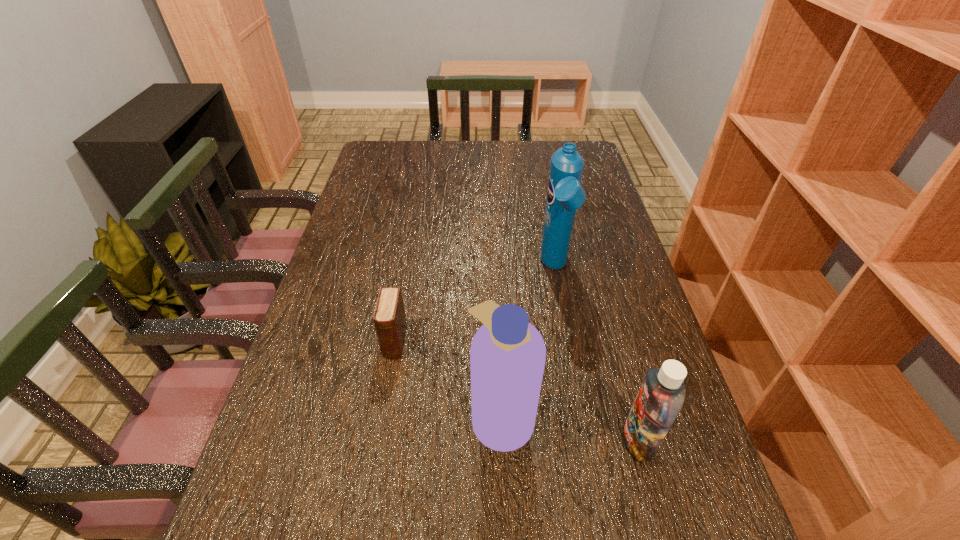
Locate an element on the screen. Image resolution: width=960 pixels, height=540 pixels. the third object from left to right is located at coordinates (565, 195).

Where is `the second shampoo from right to left`? The image size is (960, 540). the second shampoo from right to left is located at coordinates (565, 195).

Image resolution: width=960 pixels, height=540 pixels. Find the location of `the third object from right to left`. the third object from right to left is located at coordinates click(x=507, y=356).

You are a GUI agent. You are given a task and a screenshot of the screen. Output one action in this format:
    pyautogui.click(x=<x>, y=<y>)
    Task: Click on the shortest shampoo
    
    Given the screenshot: What is the action you would take?
    pyautogui.click(x=661, y=396)

Locate an element on the screen. The image size is (960, 540). the rightmost shampoo is located at coordinates (661, 396).

Identify the location of diary. This screenshot has width=960, height=540. (389, 317).

Find the location of a particular element. The width and height of the screenshot is (960, 540). the second farthest object is located at coordinates (389, 317).

You are a GUI agent. You are given a task and a screenshot of the screen. Output one action in this format:
    pyautogui.click(x=<x>, y=<y>)
    Task: Click on the vacant space situated on the left of the second shampoo from right to left
    This screenshot has height=540, width=960.
    Given the screenshot: What is the action you would take?
    pyautogui.click(x=405, y=268)

I want to click on free point located on the back of the leftmost shampoo, so click(498, 330).

This screenshot has width=960, height=540. Identify the location of free space located on the front label of the third tallest object. (441, 440).